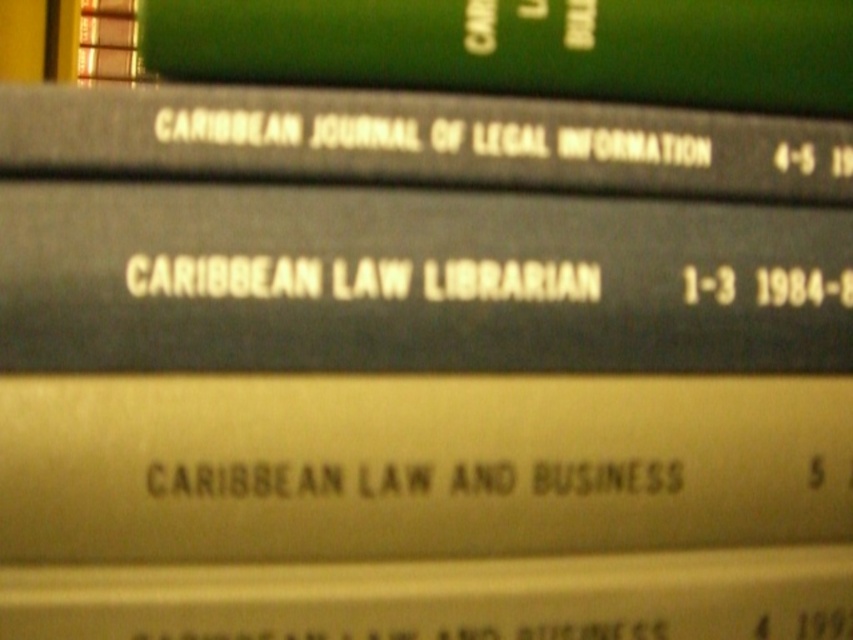
Can you confirm if black matte book at upper center is shorter than green matte book at upper center?

Indeed, black matte book at upper center has a lesser height compared to green matte book at upper center.

Does point (811, 196) come in front of point (383, 80)?

No, it is not.

Which is in front, point (839, 131) or point (453, 54)?

Point (453, 54) is more forward.

The image size is (853, 640). What are the coordinates of `black matte book at upper center` in the screenshot? It's located at (421, 141).

Does black matte book at center have a lesser height compared to black matte book at upper center?

No, black matte book at center is not shorter than black matte book at upper center.

Where is `black matte book at center`? The image size is (853, 640). black matte book at center is located at coordinates (413, 282).

Locate an element on the screen. The image size is (853, 640). black matte book at center is located at coordinates click(x=413, y=282).

Find the location of a particular element. matte gold book at center is located at coordinates (415, 465).

Between matte gold book at center and black matte book at center, which one appears on the right side from the viewer's perspective?

matte gold book at center is more to the right.

This screenshot has width=853, height=640. In order to click on matte gold book at center in this screenshot , I will do `click(415, 465)`.

You are a GUI agent. You are given a task and a screenshot of the screen. Output one action in this format:
    pyautogui.click(x=<x>, y=<y>)
    Task: Click on the matte gold book at center
    
    Given the screenshot: What is the action you would take?
    pyautogui.click(x=415, y=465)